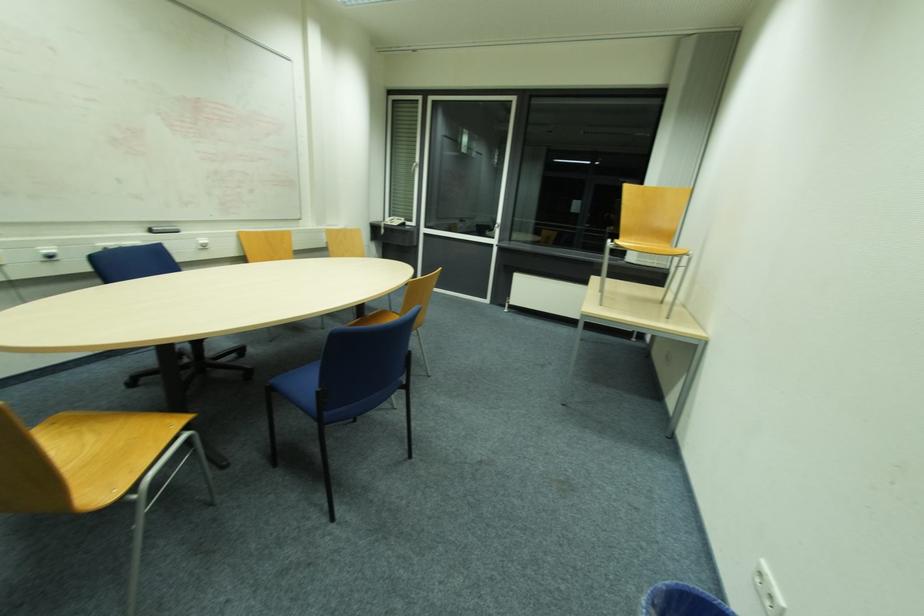
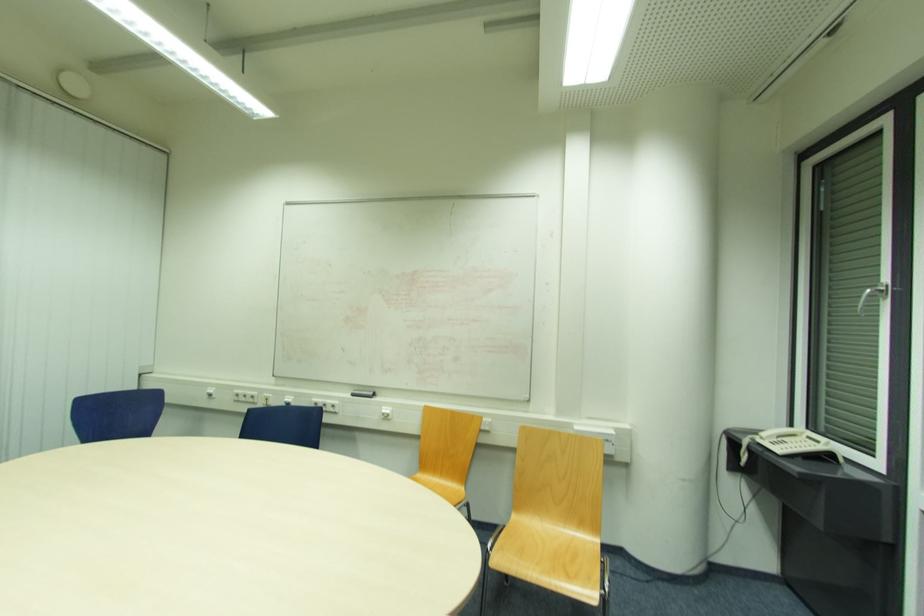
Find the pixel in the second image that matches [395,220] in the first image.

(793, 436)